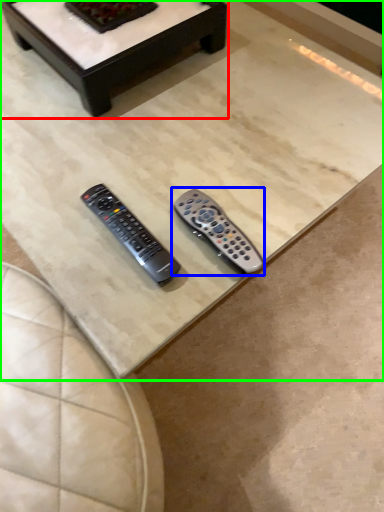
Question: Which object is the closest to the coffee table (highlighted by a red box)? Choose among these: remote control (highlighted by a blue box) or coffee table (highlighted by a green box).

Choices:
 (A) remote control
 (B) coffee table

Answer: (B)